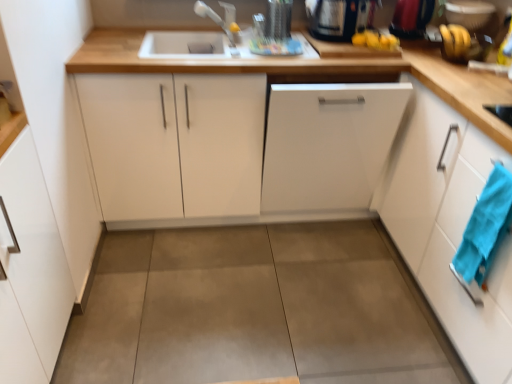
At what (x,y) coordinates should I click in order to perform the action: click on free space in front of metallic silver kettle at upper right, arranged as the second appliance when viewed from the right. Please return your answer as a coordinate pair (x, y). This screenshot has width=512, height=384. Looking at the image, I should click on (419, 55).